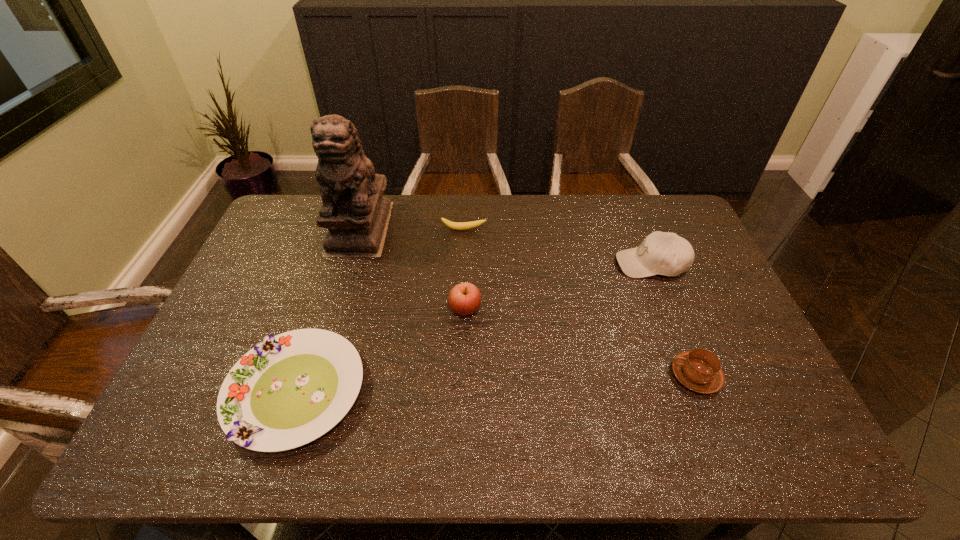
This screenshot has height=540, width=960. I want to click on vacant region between the baseball cap and the third shortest object, so click(674, 320).

Where is `vacant space in between the salad plate and the third shortest object`? The width and height of the screenshot is (960, 540). vacant space in between the salad plate and the third shortest object is located at coordinates (496, 383).

Where is `free space that is in between the salad plate and the cappuccino`? This screenshot has height=540, width=960. free space that is in between the salad plate and the cappuccino is located at coordinates (496, 383).

This screenshot has width=960, height=540. I want to click on free area in between the sculpture and the salad plate, so click(328, 310).

Find the location of `vacant space that is in between the sculpture and the banana`. vacant space that is in between the sculpture and the banana is located at coordinates (412, 229).

The image size is (960, 540). In order to click on free space between the second tallest object and the third tallest object in this screenshot , I will do `click(558, 287)`.

At what (x,y) coordinates should I click in order to perform the action: click on vacant point located between the fourth farthest object and the sculpture. Please return your answer as a coordinate pair (x, y). Image resolution: width=960 pixels, height=540 pixels. Looking at the image, I should click on (413, 269).

Where is `empty space that is in between the tallest object and the cappuccino`? empty space that is in between the tallest object and the cappuccino is located at coordinates (528, 302).

Where is `free space between the salad plate and the tallest object`? The image size is (960, 540). free space between the salad plate and the tallest object is located at coordinates (328, 310).

The image size is (960, 540). Find the location of `object that is the closest one to the apple`. object that is the closest one to the apple is located at coordinates (289, 390).